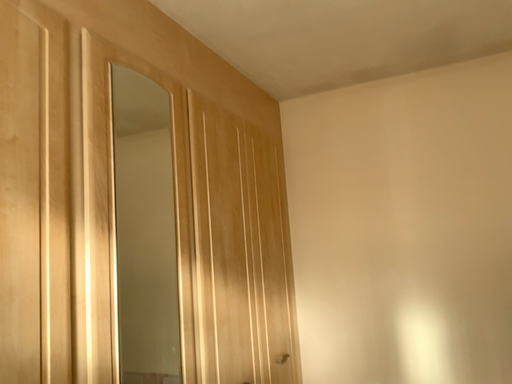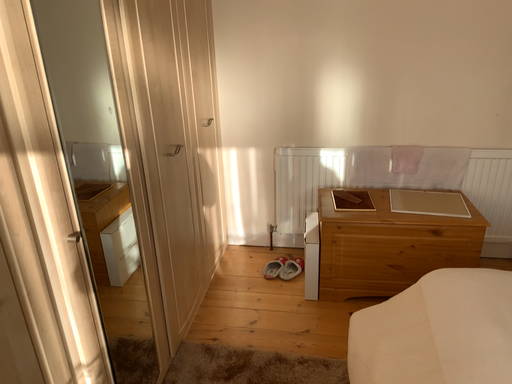
Question: How did the camera likely rotate when shooting the video?

Choices:
 (A) rotated upward
 (B) rotated downward

Answer: (B)